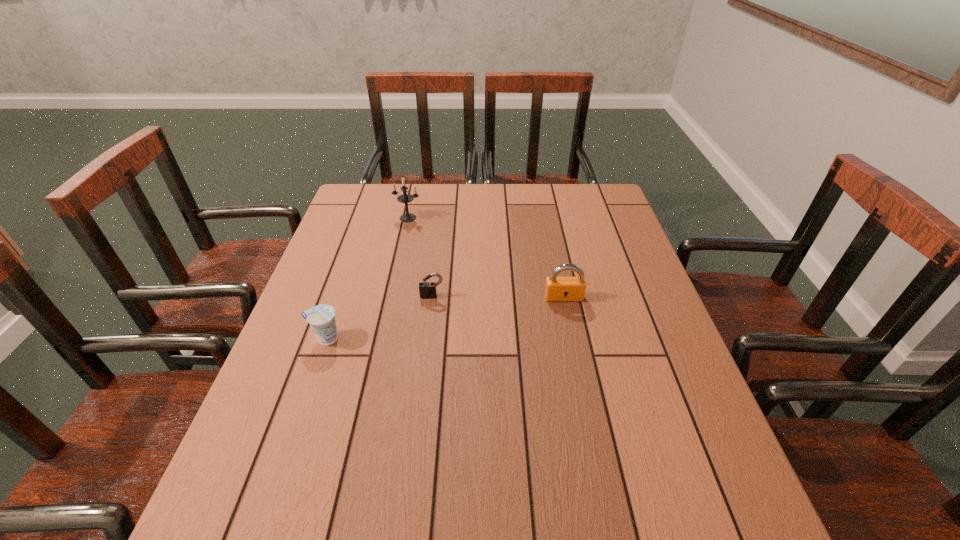
Identify the location of object that is the third closest one to the leftmost object. This screenshot has width=960, height=540. (557, 288).